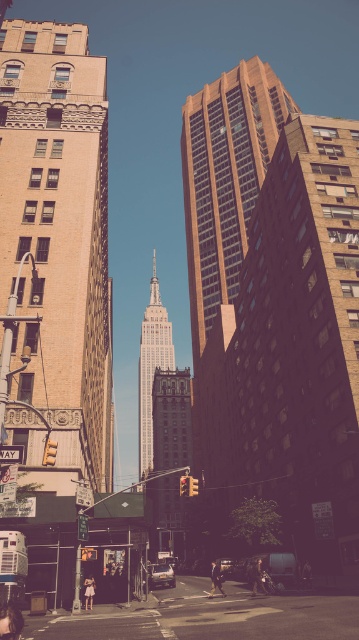
Between brick textured building at center and white cotton dress at lower center, which one appears on the right side from the viewer's perspective?

Positioned to the right is brick textured building at center.

Is brick textured building at center bigger than white cotton dress at lower center?

Yes, brick textured building at center is bigger than white cotton dress at lower center.

Is point (202, 310) behind point (86, 605)?

Yes.

Locate an element on the screen. This screenshot has height=640, width=359. brick textured building at center is located at coordinates (225, 179).

Is brick textured building at center positioned at the back of dark brown leather jacket at center?

Yes, brick textured building at center is further from the viewer.

The image size is (359, 640). What do you see at coordinates (225, 179) in the screenshot?
I see `brick textured building at center` at bounding box center [225, 179].

Between point (194, 224) and point (211, 596), which one is positioned in front?

Point (211, 596) is in front.

This screenshot has width=359, height=640. I want to click on brick textured building at center, so click(x=225, y=179).

Does point (243, 216) come behind point (258, 573)?

Yes.

Who is taller, brick textured building at center or dark brown leather jacket at lower center?

brick textured building at center

This screenshot has height=640, width=359. I want to click on brick textured building at center, so coord(225,179).